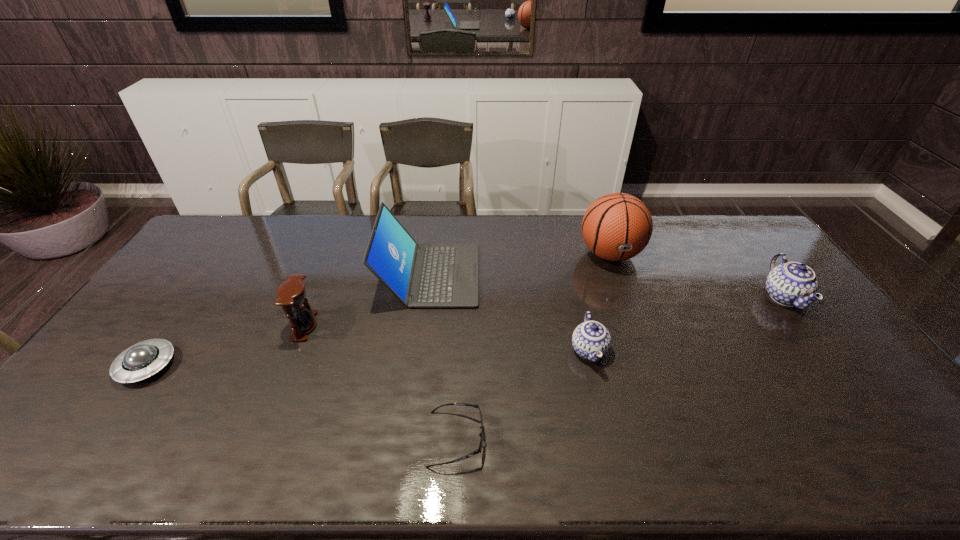
Find the location of a particular element. This screenshot has height=540, width=960. free space between the laptop computer and the farther chinaware is located at coordinates (607, 286).

Locate an element on the screen. This screenshot has height=540, width=960. empty space between the taller chinaware and the laptop computer is located at coordinates (607, 286).

Where is `blank region between the farther chinaware and the basketball`? blank region between the farther chinaware and the basketball is located at coordinates (697, 276).

This screenshot has height=540, width=960. Find the location of `vacant space that is in between the tallest object and the saucer`. vacant space that is in between the tallest object and the saucer is located at coordinates (378, 310).

You are a GUI agent. You are given a task and a screenshot of the screen. Output one action in this format:
    pyautogui.click(x=<x>, y=<y>)
    Task: Click on the vacant area between the second tallest object and the sunglasses
    The height and width of the screenshot is (540, 960).
    Given the screenshot: What is the action you would take?
    pyautogui.click(x=443, y=357)

This screenshot has height=540, width=960. Identify the location of free space between the right chinaware and the shorter chinaware. (686, 324).

At what (x,y) coordinates should I click in order to perform the action: click on free spot between the saucer and the shortest object. Please return your answer as a coordinate pair (x, y). The height and width of the screenshot is (540, 960). Looking at the image, I should click on (301, 402).

Locate an element on the screen. This screenshot has width=960, height=540. free space between the sixth shortest object and the second object from left to right is located at coordinates (367, 301).

Image resolution: width=960 pixels, height=540 pixels. In order to click on object identified as the third closest to the second tallest object in this screenshot , I will do `click(618, 226)`.

Locate an element on the screen. object that is the fifth nearest to the basketball is located at coordinates (291, 294).